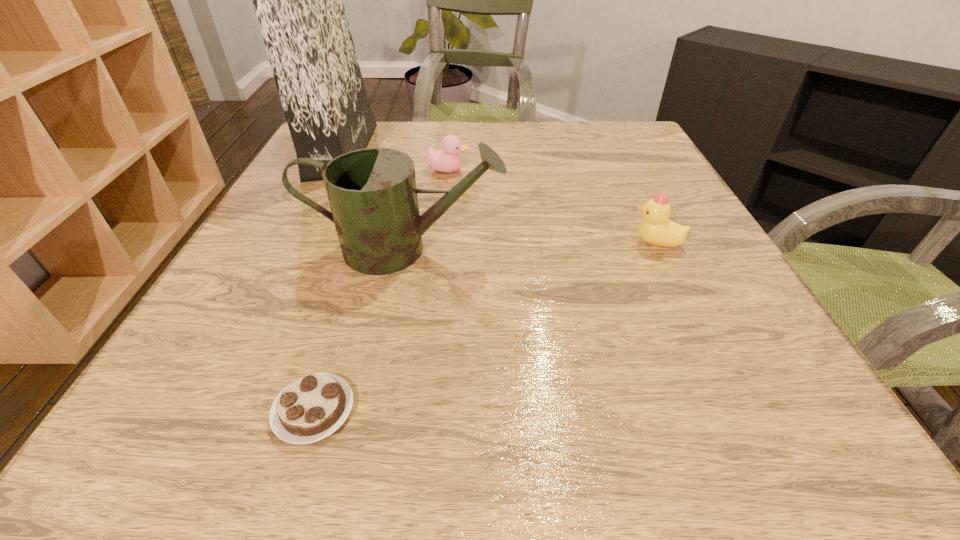
I want to click on the tallest object, so click(298, 0).

You are a GUI agent. You are given a task and a screenshot of the screen. Output one action in this format:
    pyautogui.click(x=<x>, y=<y>)
    Task: Click on the watering can
    The height and width of the screenshot is (540, 960).
    Given the screenshot: What is the action you would take?
    pyautogui.click(x=372, y=192)

Where is `the nearer duckling`? the nearer duckling is located at coordinates (656, 229).

Find the location of a particular element. This screenshot has height=540, width=960. the rightmost object is located at coordinates (656, 229).

This screenshot has height=540, width=960. In order to click on the left duckling in this screenshot , I will do `click(448, 160)`.

Identify the location of the shortest object. (309, 409).

The height and width of the screenshot is (540, 960). In order to click on chocolate cake in this screenshot , I will do [x=309, y=409].

This screenshot has width=960, height=540. I want to click on blank space located on the front of the shopping bag with the design, so coord(490,151).

Locate an element on the screen. The image size is (960, 540). blank space located with the spout on the watering can is located at coordinates (560, 249).

Where is `vacant region located 0.210m on the front-facing side of the right duckling`? The height and width of the screenshot is (540, 960). vacant region located 0.210m on the front-facing side of the right duckling is located at coordinates (516, 242).